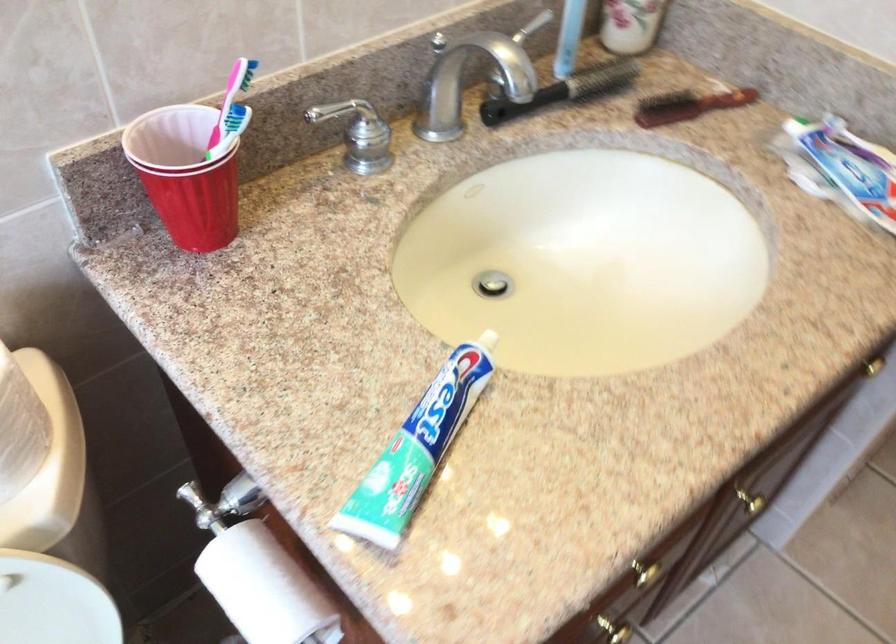
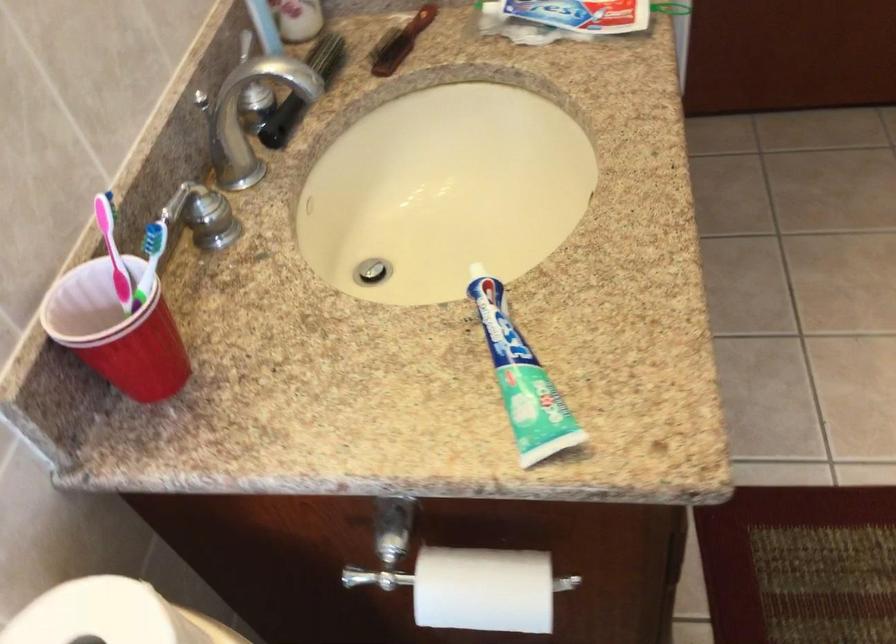
Find the pixel in the second image that matches (x=685, y=107) in the first image.

(400, 42)